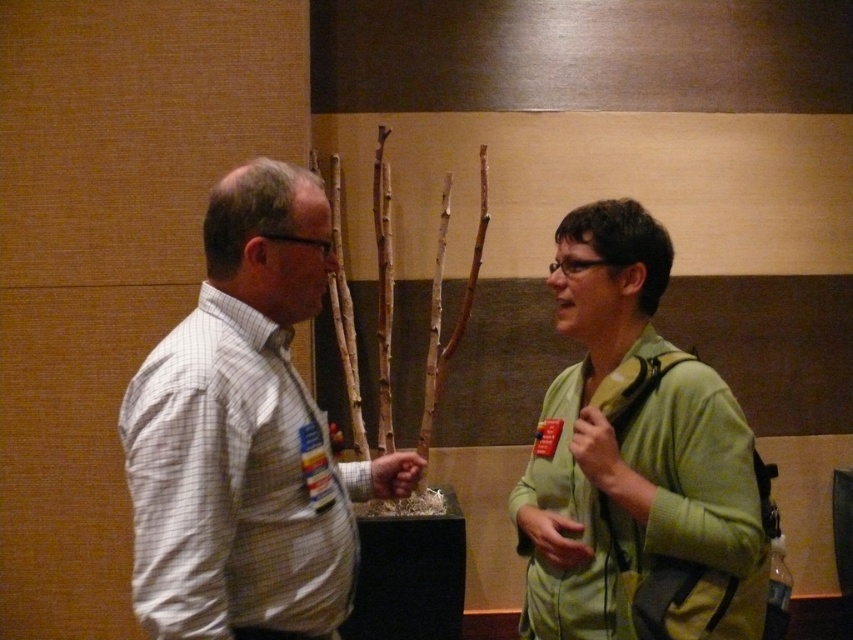
Question: Which point is closer to the camera taking this photo?

Choices:
 (A) (276, 208)
 (B) (294, 566)

Answer: (B)

Question: Which point appears closest to the camera in this image?

Choices:
 (A) (206, 225)
 (B) (223, 406)

Answer: (B)

Question: Does green matte jacket at center come behind white checkered shirt at left?

Choices:
 (A) no
 (B) yes

Answer: (B)

Question: Does white checkered shirt at left come behind green matte jacket at right?

Choices:
 (A) yes
 (B) no

Answer: (B)

Question: Is green matte jacket at center wider than white checkered shirt at left?

Choices:
 (A) yes
 (B) no

Answer: (A)

Question: Which of the following is the farthest from the observer?

Choices:
 (A) (177, 397)
 (B) (257, 506)
 (C) (701, 484)

Answer: (C)